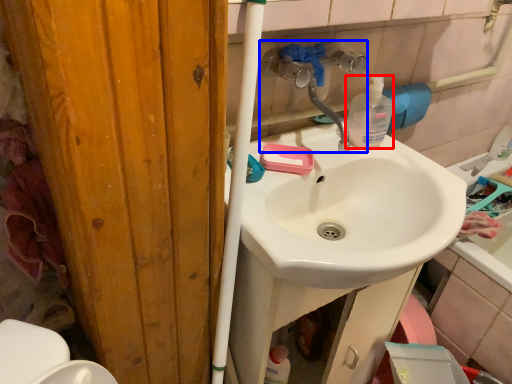
Question: Which object is closer to the camera taking this photo, bottle (highlighted by a red box) or plumbing fixture (highlighted by a blue box)?

Choices:
 (A) bottle
 (B) plumbing fixture

Answer: (B)